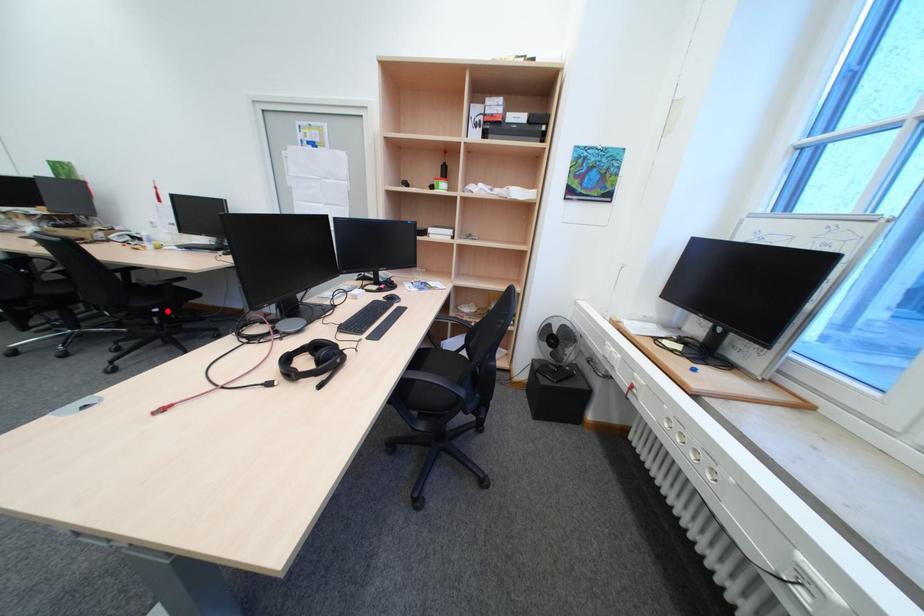
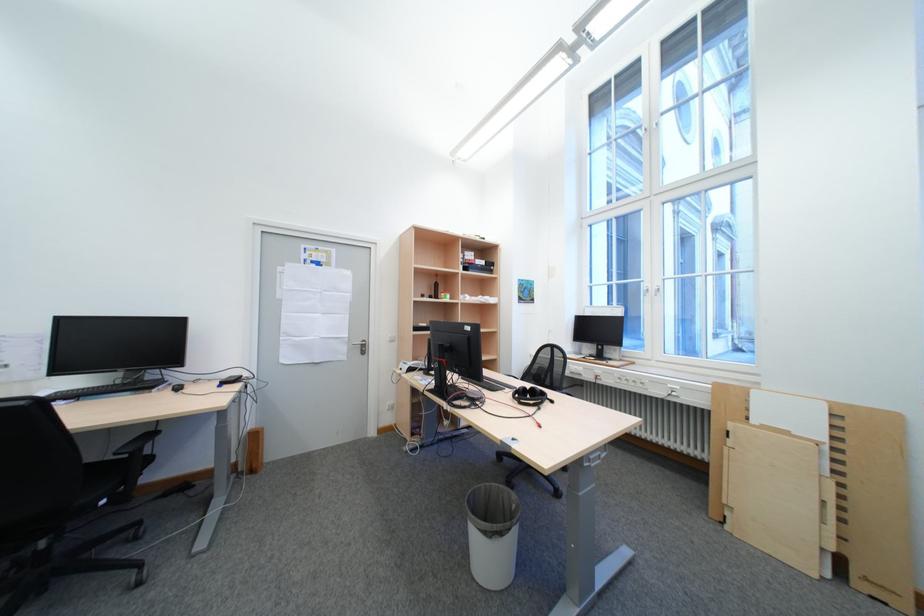
Locate, in the second image, the point that corresponds to the highlighted location in the first image.

(116, 503)